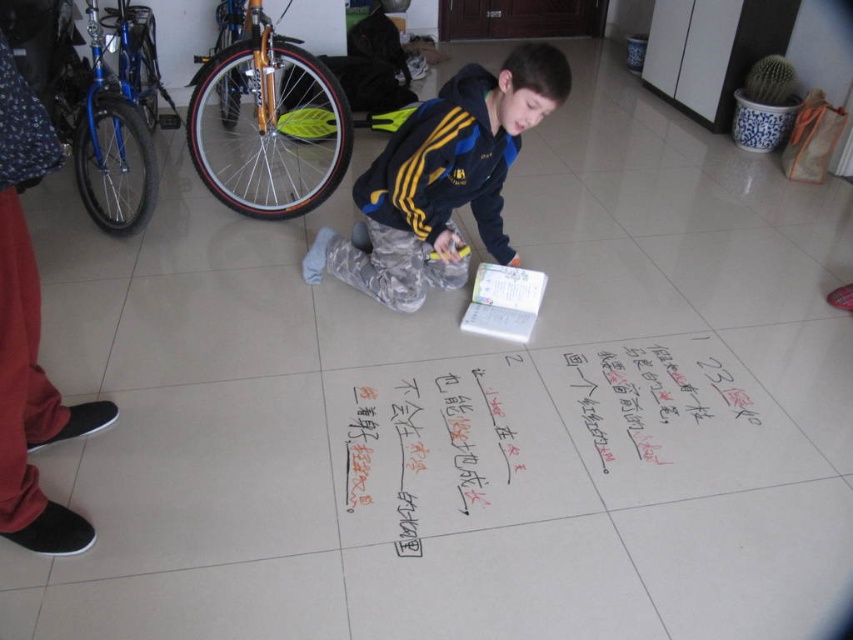
Question: Is dark blue fleece jacket at center positioned in front of gold metallic bicycle wheel at left?

Choices:
 (A) yes
 (B) no

Answer: (A)

Question: Among these objects, which one is farthest from the camera?

Choices:
 (A) dark blue fleece jacket at center
 (B) blue metallic bicycle at upper left

Answer: (B)

Question: Where is handwritten paper at center located in relation to dark blue fleece jacket at center in the image?

Choices:
 (A) above
 (B) below

Answer: (B)

Question: From the image, what is the correct spatial relationship of dark blue fleece jacket at center in relation to gold metallic bicycle wheel at left?

Choices:
 (A) right
 (B) left

Answer: (A)

Question: Estimate the real-world distances between objects in this image. Which object is farther from the handwritten paper at center?

Choices:
 (A) blue metallic bicycle at upper left
 (B) dark blue fleece jacket at center

Answer: (A)

Question: Which object is farther from the camera taking this photo?

Choices:
 (A) gold metallic bicycle wheel at left
 (B) handwritten paper at center
 (C) dark blue fleece jacket at center
 (D) blue metallic bicycle at upper left

Answer: (A)